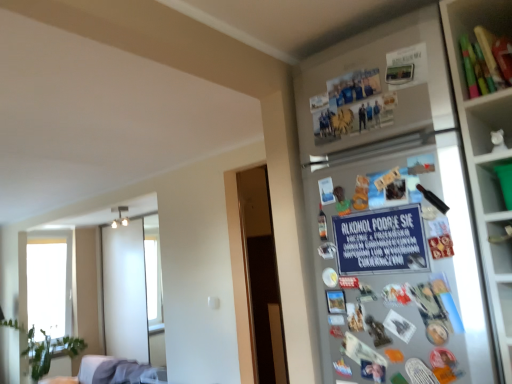
Question: Considering the positions of transparent glass window at left and green plastic container at upper right in the image, is transparent glass window at left wider or thinner than green plastic container at upper right?

Choices:
 (A) wide
 (B) thin

Answer: (A)

Question: From a real-world perspective, relative to green plastic container at upper right, is transparent glass window at left vertically above or below?

Choices:
 (A) above
 (B) below

Answer: (B)

Question: Considering the real-world distances, which object is farthest from the blue paper sign at upper right?

Choices:
 (A) silver metallic fridge at upper right
 (B) white fabric couch at lower left
 (C) transparent glass window at left
 (D) green plastic container at upper right
 (E) matte plastic utensils at upper right

Answer: (C)

Question: Which object is positioned closest to the blue paper sign at upper right?

Choices:
 (A) green plastic container at upper right
 (B) white fabric couch at lower left
 (C) silver metallic fridge at upper right
 (D) matte plastic utensils at upper right
 (E) transparent glass window at left

Answer: (C)